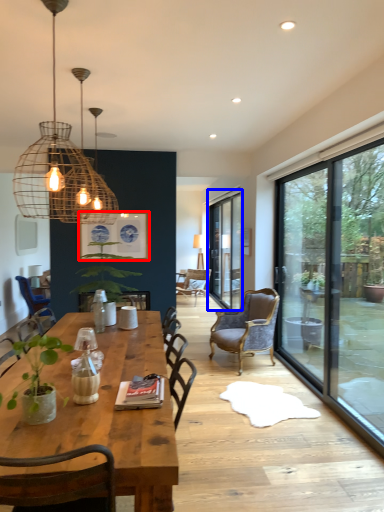
Question: Which point is closer to the camera, picture frame (highlighted by a red box) or window (highlighted by a blue box)?

Choices:
 (A) picture frame
 (B) window

Answer: (A)